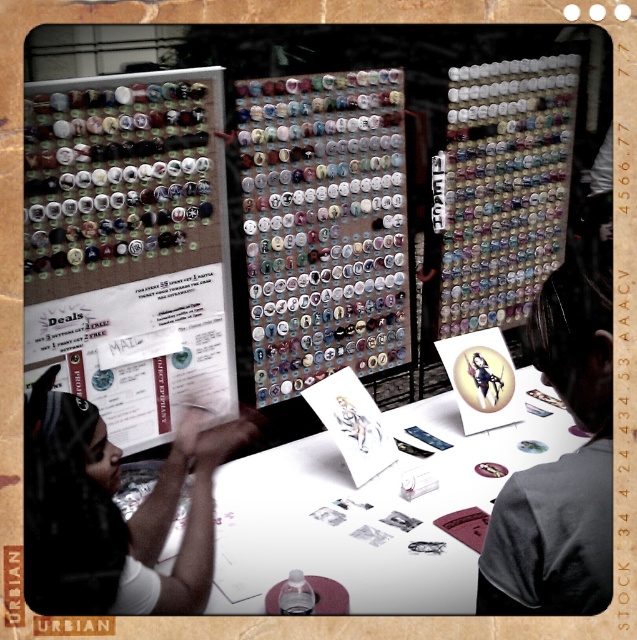
Question: Considering the real-world distances, which object is closest to the matte black button at center?

Choices:
 (A) white paper at center
 (B) matte plastic button at center
 (C) matte black shirt at left

Answer: (B)

Question: Estimate the real-world distances between objects in this image. Which object is farther from the white paper at center?

Choices:
 (A) matte plastic button at center
 (B) matte plastic buttons at left

Answer: (A)

Question: Does white paper at center appear over matte plastic button at center?

Choices:
 (A) yes
 (B) no

Answer: (B)

Question: Is matte plastic buttons at left behind white paper at center?

Choices:
 (A) no
 (B) yes

Answer: (B)

Question: Among these objects, which one is nearest to the camera?

Choices:
 (A) matte black shirt at left
 (B) matte plastic button at center
 (C) matte plastic buttons at left
 (D) matte black button at center

Answer: (D)

Question: Is matte black shirt at left positioned before matte black button at center?

Choices:
 (A) yes
 (B) no

Answer: (B)